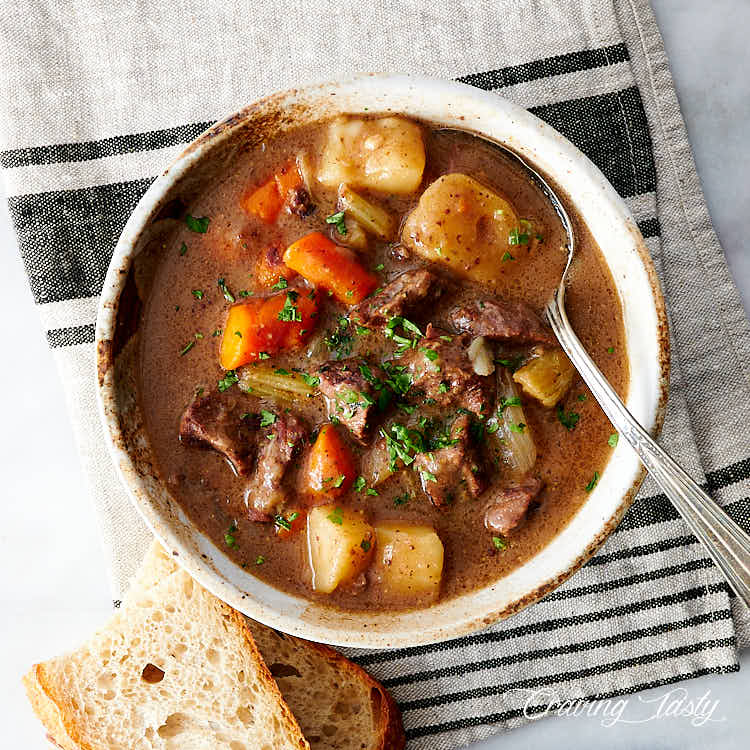
I want to click on towel, so click(27, 94).